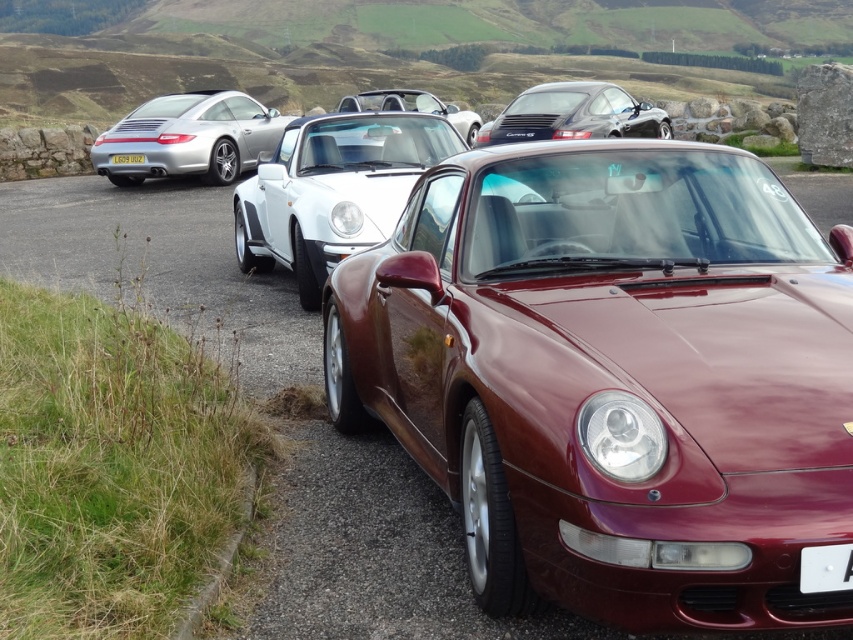
You are a photographer standing at the white plastic license plate at lower right, aiming to capture the white matte convertible at center in your shot. Given that your camera has a maximum zoom range of 10 meters, will you be able to focus on the convertible without moving closer?

The distance between the white matte convertible at center and the white plastic license plate at lower right is 10.39 meters. Since the camera can only zoom up to 10 meters, you won need to move closer to focus on the convertible.

You are standing at the position of the camera, looking at the two points labeled point (238, 115) and point (117, 157) in the image. Which point appears closer to you?

Point (238, 115) is further to the camera than point (117, 157), so the point that appears closer to you is point (117, 157).